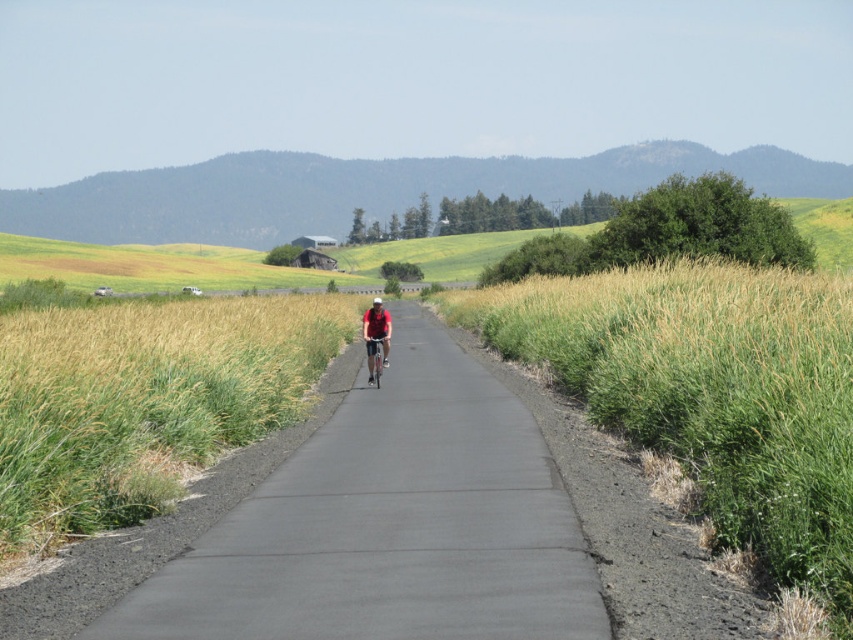
Question: Can you confirm if black asphalt road at center is positioned to the right of metallic silver bicycle at center?

Choices:
 (A) yes
 (B) no

Answer: (A)

Question: Which object is the closest to the metallic silver bicycle at center?

Choices:
 (A) green grass at right
 (B) black asphalt road at center
 (C) green grass at center
 (D) red matte shirt at center

Answer: (D)

Question: Which of the following is the farthest from the observer?

Choices:
 (A) (370, 340)
 (B) (329, 432)
 (C) (851, 442)
 (D) (375, 310)

Answer: (D)

Question: From the image, what is the correct spatial relationship of black asphalt road at center in relation to red matte shirt at center?

Choices:
 (A) left
 (B) right

Answer: (B)

Question: Which object is positioned closest to the metallic silver bicycle at center?

Choices:
 (A) red matte shirt at center
 (B) green grass at right

Answer: (A)

Question: Can you confirm if green grass at center is wider than metallic silver bicycle at center?

Choices:
 (A) yes
 (B) no

Answer: (A)